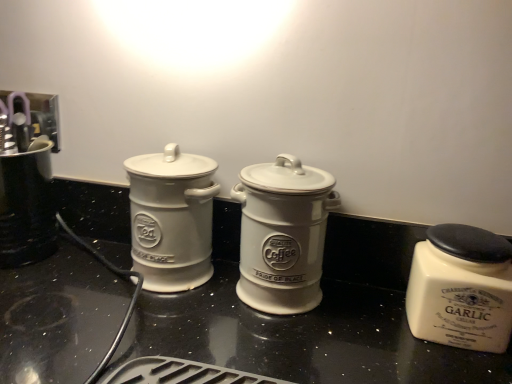
The image size is (512, 384). What do you see at coordinates (27, 177) in the screenshot?
I see `brushed metal coffee maker at left` at bounding box center [27, 177].

What do you see at coordinates (461, 288) in the screenshot? I see `white ceramic garlic jar at right, the third kitchen appliance from the left` at bounding box center [461, 288].

Describe the element at coordinates (170, 218) in the screenshot. I see `white ceramic jar at left, positioned as the 1th kitchen appliance in left-to-right order` at that location.

How much space does white ceramic jar at left, acting as the third kitchen appliance starting from the right, occupy vertically?

white ceramic jar at left, acting as the third kitchen appliance starting from the right, is 7.00 inches in height.

Where is `brushed metal coffee maker at left`? The width and height of the screenshot is (512, 384). brushed metal coffee maker at left is located at coordinates (27, 177).

Is the surface of brushed metal coffee maker at left in direct contact with white ceramic garlic jar at right, the third kitchen appliance from the left?

brushed metal coffee maker at left and white ceramic garlic jar at right, the third kitchen appliance from the left, are clearly separated.

Could white ceramic garlic jar at right, the third kitchen appliance from the left, be considered to be inside brushed metal coffee maker at left?

No, white ceramic garlic jar at right, the third kitchen appliance from the left, is not a part of brushed metal coffee maker at left.

Is brushed metal coffee maker at left bigger than white ceramic garlic jar at right, the third kitchen appliance from the left?

Yes.

Consider the image. Does brushed metal coffee maker at left lie behind white ceramic garlic jar at right, the third kitchen appliance from the left?

Yes, it is.

From a real-world perspective, is white ceramic jar at left, positioned as the 1th kitchen appliance in left-to-right order, positioned under white ceramic garlic jar at right, the third kitchen appliance from the left, based on gravity?

Incorrect, from a real-world perspective, white ceramic jar at left, positioned as the 1th kitchen appliance in left-to-right order, is higher than white ceramic garlic jar at right, the third kitchen appliance from the left.

Consider the image. Which object is more forward, white ceramic jar at left, acting as the third kitchen appliance starting from the right, or white ceramic garlic jar at right, the third kitchen appliance from the left?

white ceramic garlic jar at right, the third kitchen appliance from the left, is closer to the camera.

The height and width of the screenshot is (384, 512). Identify the location of the 2nd kitchen appliance counting from the left side of the white ceramic garlic jar at right, the third kitchen appliance from the left. (170, 218).

From the image's perspective, is white ceramic coffee canister at center, acting as the 2th kitchen appliance starting from the right, below white ceramic jar at left, positioned as the 1th kitchen appliance in left-to-right order?

Indeed, from the image's perspective, white ceramic coffee canister at center, acting as the 2th kitchen appliance starting from the right, is shown beneath white ceramic jar at left, positioned as the 1th kitchen appliance in left-to-right order.

From the picture: Which object is more forward, white ceramic coffee canister at center, acting as the 2th kitchen appliance starting from the right, or white ceramic jar at left, positioned as the 1th kitchen appliance in left-to-right order?

Positioned in front is white ceramic coffee canister at center, acting as the 2th kitchen appliance starting from the right.

You are a GUI agent. You are given a task and a screenshot of the screen. Output one action in this format:
    pyautogui.click(x=<x>, y=<y>)
    Task: Click on the kitchen appliance above the white ceramic coffee canister at center, arranged as the 2th kitchen appliance when viewed from the left (from the image's perspective)
    
    Given the screenshot: What is the action you would take?
    pyautogui.click(x=170, y=218)

Are white ceramic jar at left, acting as the third kitchen appliance starting from the right, and brushed metal coffee maker at left located far from each other?

Actually, white ceramic jar at left, acting as the third kitchen appliance starting from the right, and brushed metal coffee maker at left are a little close together.

Can you confirm if white ceramic jar at left, acting as the third kitchen appliance starting from the right, is taller than brushed metal coffee maker at left?

Yes, white ceramic jar at left, acting as the third kitchen appliance starting from the right, is taller than brushed metal coffee maker at left.

From the image's perspective, which is above, white ceramic jar at left, acting as the third kitchen appliance starting from the right, or brushed metal coffee maker at left?

brushed metal coffee maker at left, from the image's perspective.

How different are the orientations of white ceramic jar at left, positioned as the 1th kitchen appliance in left-to-right order, and brushed metal coffee maker at left in degrees?

The angular difference between white ceramic jar at left, positioned as the 1th kitchen appliance in left-to-right order, and brushed metal coffee maker at left is 2.31 degrees.

Based on their sizes in the image, would you say white ceramic garlic jar at right, which is the 1th kitchen appliance in right-to-left order, is bigger or smaller than white ceramic coffee canister at center, arranged as the 2th kitchen appliance when viewed from the left?

Clearly, white ceramic garlic jar at right, which is the 1th kitchen appliance in right-to-left order, is smaller in size than white ceramic coffee canister at center, arranged as the 2th kitchen appliance when viewed from the left.

From a real-world perspective, is white ceramic garlic jar at right, the third kitchen appliance from the left, positioned under white ceramic coffee canister at center, acting as the 2th kitchen appliance starting from the right, based on gravity?

Yes, from a real-world perspective, white ceramic garlic jar at right, the third kitchen appliance from the left, is beneath white ceramic coffee canister at center, acting as the 2th kitchen appliance starting from the right.

Considering the positions of objects white ceramic garlic jar at right, which is the 1th kitchen appliance in right-to-left order, and white ceramic coffee canister at center, arranged as the 2th kitchen appliance when viewed from the left, in the image provided, who is behind, white ceramic garlic jar at right, which is the 1th kitchen appliance in right-to-left order, or white ceramic coffee canister at center, arranged as the 2th kitchen appliance when viewed from the left,?

white ceramic coffee canister at center, arranged as the 2th kitchen appliance when viewed from the left.

Is white ceramic garlic jar at right, the third kitchen appliance from the left, completely or partially outside of white ceramic coffee canister at center, arranged as the 2th kitchen appliance when viewed from the left?

Yes, white ceramic garlic jar at right, the third kitchen appliance from the left, is located beyond the bounds of white ceramic coffee canister at center, arranged as the 2th kitchen appliance when viewed from the left.

Is brushed metal coffee maker at left inside or outside of white ceramic coffee canister at center, arranged as the 2th kitchen appliance when viewed from the left?

brushed metal coffee maker at left is located beyond the bounds of white ceramic coffee canister at center, arranged as the 2th kitchen appliance when viewed from the left.

From a real-world perspective, between brushed metal coffee maker at left and white ceramic coffee canister at center, acting as the 2th kitchen appliance starting from the right, who is vertically lower?

brushed metal coffee maker at left.

From the image's perspective, does brushed metal coffee maker at left appear lower than white ceramic coffee canister at center, acting as the 2th kitchen appliance starting from the right?

A: No.

From the picture: Considering their positions, is brushed metal coffee maker at left located in front of or behind white ceramic coffee canister at center, acting as the 2th kitchen appliance starting from the right?

Clearly, brushed metal coffee maker at left is behind white ceramic coffee canister at center, acting as the 2th kitchen appliance starting from the right.

Which of these two, white ceramic coffee canister at center, acting as the 2th kitchen appliance starting from the right, or brushed metal coffee maker at left, is thinner?

With smaller width is white ceramic coffee canister at center, acting as the 2th kitchen appliance starting from the right.

Do you think white ceramic coffee canister at center, acting as the 2th kitchen appliance starting from the right, is within brushed metal coffee maker at left, or outside of it?

white ceramic coffee canister at center, acting as the 2th kitchen appliance starting from the right, exists outside the volume of brushed metal coffee maker at left.

This screenshot has width=512, height=384. I want to click on appliance to the left of white ceramic coffee canister at center, acting as the 2th kitchen appliance starting from the right, so click(27, 177).

Which is behind, white ceramic coffee canister at center, arranged as the 2th kitchen appliance when viewed from the left, or brushed metal coffee maker at left?

brushed metal coffee maker at left.

You are a GUI agent. You are given a task and a screenshot of the screen. Output one action in this format:
    pyautogui.click(x=<x>, y=<y>)
    Task: Click on the appliance above the white ceramic garlic jar at right, the third kitchen appliance from the left (from the image's perspective)
    The image size is (512, 384).
    Given the screenshot: What is the action you would take?
    pyautogui.click(x=27, y=177)

At what (x,y) coordinates should I click in order to perform the action: click on the 2nd kitchen appliance behind when counting from the white ceramic garlic jar at right, which is the 1th kitchen appliance in right-to-left order. Please return your answer as a coordinate pair (x, y). Looking at the image, I should click on (170, 218).

Which object lies nearer to the anchor point brushed metal coffee maker at left, white ceramic coffee canister at center, acting as the 2th kitchen appliance starting from the right, or white ceramic garlic jar at right, the third kitchen appliance from the left?

white ceramic coffee canister at center, acting as the 2th kitchen appliance starting from the right.

Which object lies nearer to the anchor point brushed metal coffee maker at left, white ceramic jar at left, acting as the third kitchen appliance starting from the right, or white ceramic garlic jar at right, which is the 1th kitchen appliance in right-to-left order?

Among the two, white ceramic jar at left, acting as the third kitchen appliance starting from the right, is located nearer to brushed metal coffee maker at left.

Considering their positions, is white ceramic garlic jar at right, the third kitchen appliance from the left, positioned further to white ceramic jar at left, positioned as the 1th kitchen appliance in left-to-right order, than brushed metal coffee maker at left?

The object further to white ceramic jar at left, positioned as the 1th kitchen appliance in left-to-right order, is white ceramic garlic jar at right, the third kitchen appliance from the left.

When comparing their distances from brushed metal coffee maker at left, does white ceramic garlic jar at right, the third kitchen appliance from the left, or white ceramic jar at left, acting as the third kitchen appliance starting from the right, seem closer?

Based on the image, white ceramic jar at left, acting as the third kitchen appliance starting from the right, appears to be nearer to brushed metal coffee maker at left.

From the image, which object appears to be nearer to white ceramic garlic jar at right, which is the 1th kitchen appliance in right-to-left order, brushed metal coffee maker at left or white ceramic coffee canister at center, acting as the 2th kitchen appliance starting from the right?

The object closer to white ceramic garlic jar at right, which is the 1th kitchen appliance in right-to-left order, is white ceramic coffee canister at center, acting as the 2th kitchen appliance starting from the right.

Estimate the real-world distances between objects in this image. Which object is closer to brushed metal coffee maker at left, white ceramic garlic jar at right, which is the 1th kitchen appliance in right-to-left order, or white ceramic coffee canister at center, acting as the 2th kitchen appliance starting from the right?

The object closer to brushed metal coffee maker at left is white ceramic coffee canister at center, acting as the 2th kitchen appliance starting from the right.

Which object lies further to the anchor point brushed metal coffee maker at left, white ceramic coffee canister at center, acting as the 2th kitchen appliance starting from the right, or white ceramic jar at left, acting as the third kitchen appliance starting from the right?

white ceramic coffee canister at center, acting as the 2th kitchen appliance starting from the right, is positioned further to the anchor brushed metal coffee maker at left.

From the picture: Considering their positions, is white ceramic jar at left, acting as the third kitchen appliance starting from the right, positioned further to white ceramic garlic jar at right, the third kitchen appliance from the left, than white ceramic coffee canister at center, arranged as the 2th kitchen appliance when viewed from the left?

white ceramic jar at left, acting as the third kitchen appliance starting from the right.

The image size is (512, 384). I want to click on kitchen appliance situated between brushed metal coffee maker at left and white ceramic coffee canister at center, acting as the 2th kitchen appliance starting from the right, from left to right, so click(x=170, y=218).

Locate an element on the screen. kitchen appliance between white ceramic jar at left, acting as the third kitchen appliance starting from the right, and white ceramic garlic jar at right, the third kitchen appliance from the left, in the horizontal direction is located at coordinates (283, 234).